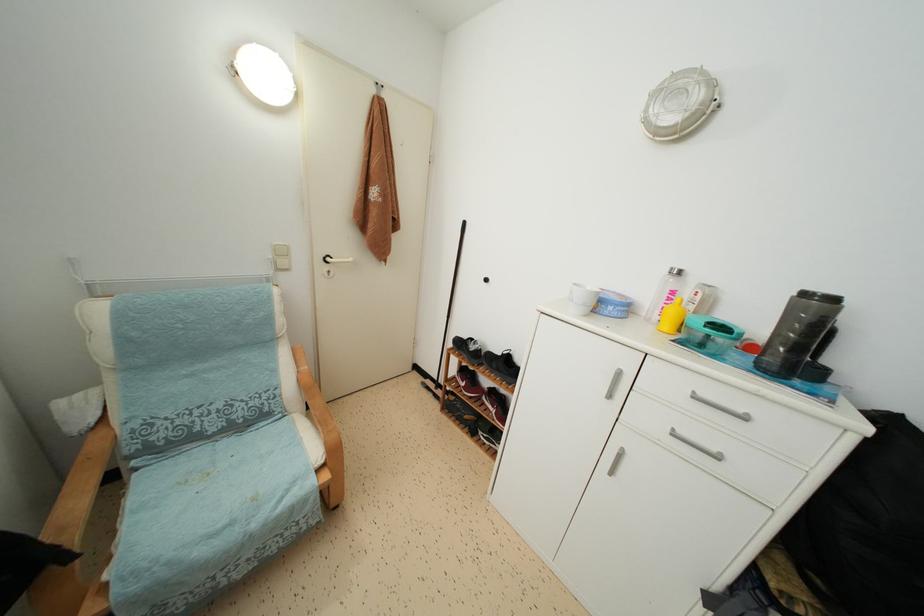
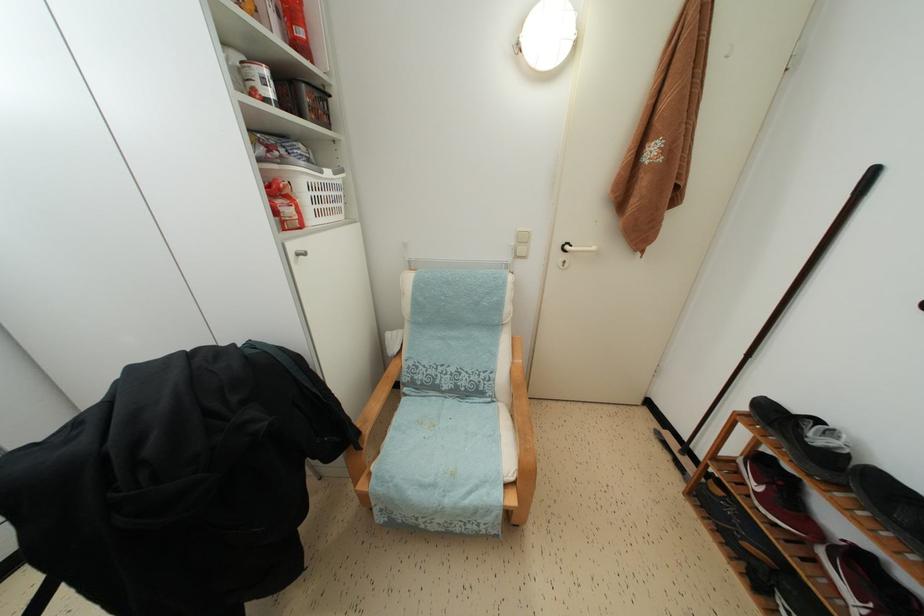
The point at (333, 265) is marked in the first image. Where is the corresponding point in the second image?

(572, 253)